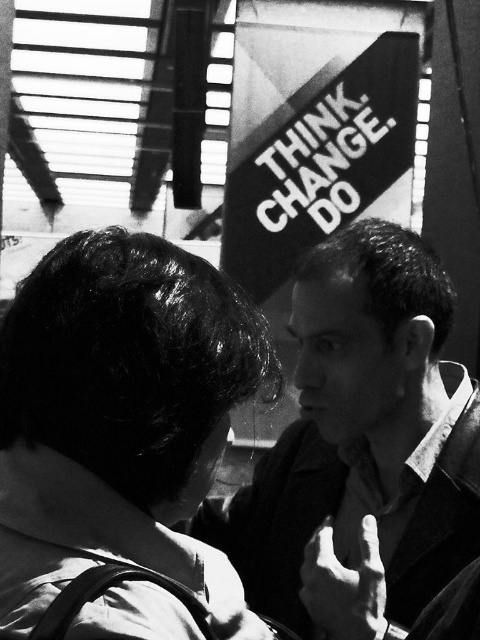
Question: Among these objects, which one is nearest to the camera?

Choices:
 (A) smooth black shirt at center
 (B) smooth skin hand at center

Answer: (B)

Question: Estimate the real-world distances between objects in this image. Which object is farther from the smooth black shirt at center?

Choices:
 (A) smooth skin hand at center
 (B) dark hair at upper left

Answer: (B)

Question: Does dark hair at upper left have a larger size compared to smooth black shirt at center?

Choices:
 (A) yes
 (B) no

Answer: (B)

Question: Observing the image, what is the correct spatial positioning of smooth black shirt at center in reference to smooth skin hand at center?

Choices:
 (A) left
 (B) right

Answer: (B)

Question: Is smooth black shirt at center bigger than smooth skin hand at center?

Choices:
 (A) no
 (B) yes

Answer: (B)

Question: Estimate the real-world distances between objects in this image. Which object is closer to the smooth black shirt at center?

Choices:
 (A) dark hair at upper left
 (B) smooth skin hand at center

Answer: (B)